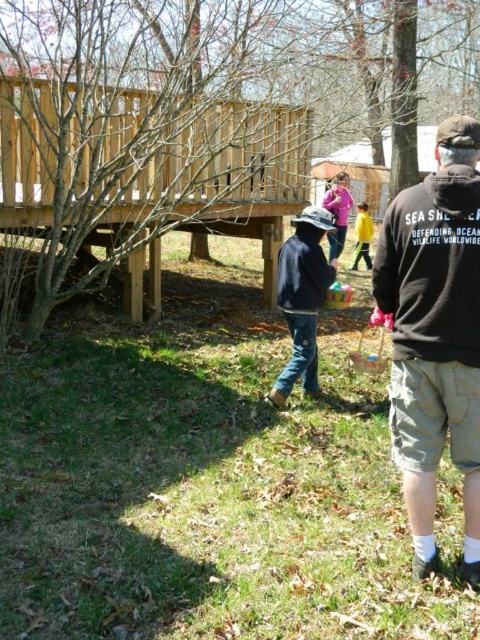
Question: Which of the following is the farthest from the observer?

Choices:
 (A) (371, 220)
 (B) (295, 232)
 (C) (468, 253)
 (D) (360, 364)

Answer: (A)

Question: Which object is positioned closest to the black fleece sweatshirt at right?

Choices:
 (A) yellow matte jacket at center
 (B) pink fabric basket at center
 (C) dark blue fleece sweatshirt at center
 (D) black cotton sweatshirt at right

Answer: (D)

Question: Is black cotton sweatshirt at right thinner than dark blue fleece sweatshirt at center?

Choices:
 (A) yes
 (B) no

Answer: (B)

Question: Which of the following is the farthest from the observer?

Choices:
 (A) click(446, 358)
 (B) click(458, 188)
 (C) click(315, 234)

Answer: (C)

Question: Where is black cotton sweatshirt at right located in relation to denim jacket at center in the image?

Choices:
 (A) left
 (B) right

Answer: (B)

Question: In this image, where is black fleece sweatshirt at right located relative to dark blue fleece sweatshirt at center?

Choices:
 (A) below
 (B) above

Answer: (A)